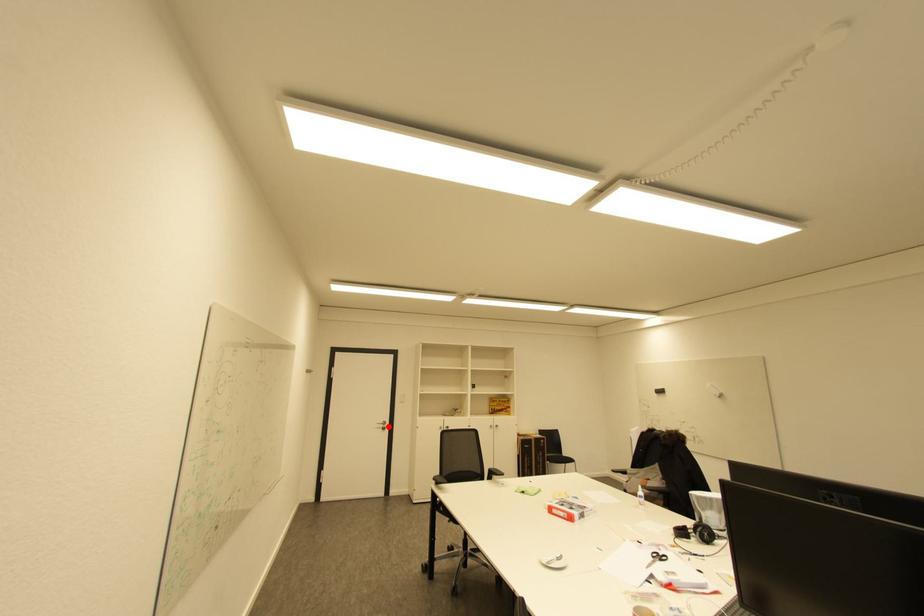
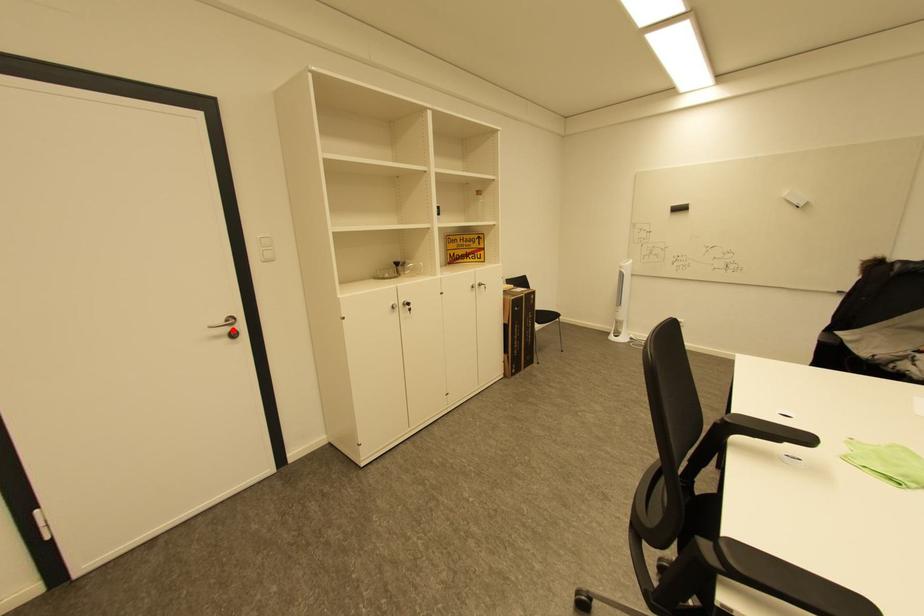
From the picture: I am providing you with two images of the same scene from different viewpoints. A red point is marked on the first image and another point is marked on the second image. Are the points marked in image1 and image2 representing the same 3D position?

Yes